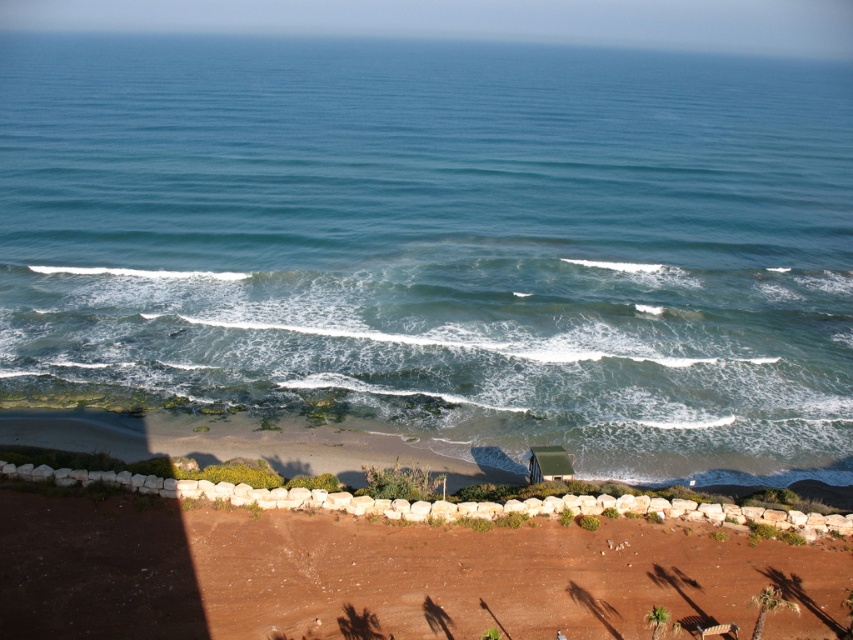
You are standing at the top of the cliff overlooking the coastal scene. You notice the blue water at center and the brown sandy soil at lower center. Which of these two areas is wider from left to right?

The blue water at center is wider than the brown sandy soil at lower center because its width surpasses that of the sandy soil.

You are standing at the top of the slope on the reddish brown sandy area. You want to walk directly to the blue water at center. Which direction should you walk?

Since the blue water at center is located at point (440, 243) in the image, you should walk downward towards the center of the scene to reach it.

You are standing on the brown sandy soil at lower center and want to reach the blue water at center. Which direction should you move to get there?

You should move to the right to reach the blue water at center since it is located to the right of the brown sandy soil at lower center.